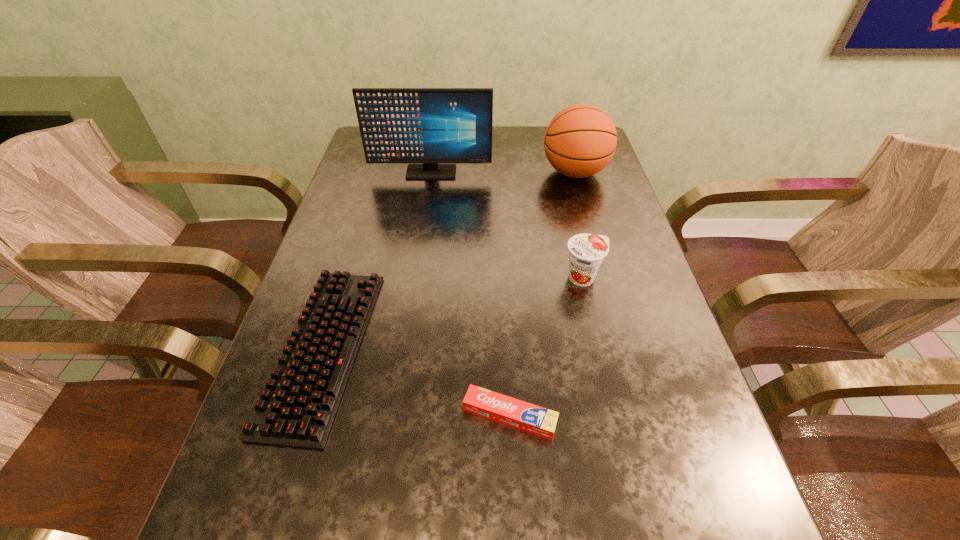
Where is `computer monitor`? The image size is (960, 540). computer monitor is located at coordinates (398, 125).

Find the location of a particular element. the second tallest object is located at coordinates [x=580, y=141].

This screenshot has width=960, height=540. I want to click on the third shortest object, so click(586, 251).

Locate an element on the screen. This screenshot has height=540, width=960. toothpaste is located at coordinates (503, 409).

Locate an element on the screen. Image resolution: width=960 pixels, height=540 pixels. computer keyboard is located at coordinates (297, 407).

Where is `free region located on the screen side of the computer monitor`? This screenshot has width=960, height=540. free region located on the screen side of the computer monitor is located at coordinates (420, 246).

I want to click on blank area located 0.300m on the front of the basketball, so click(600, 264).

Locate an element on the screen. vacant space located 0.060m on the right of the yogurt is located at coordinates (630, 278).

Identify the location of vacant space located 0.070m on the front of the toothpaste. Image resolution: width=960 pixels, height=540 pixels. (513, 484).

What are the coordinates of `vacant space located 0.280m on the back of the computer keyboard` in the screenshot? It's located at (368, 204).